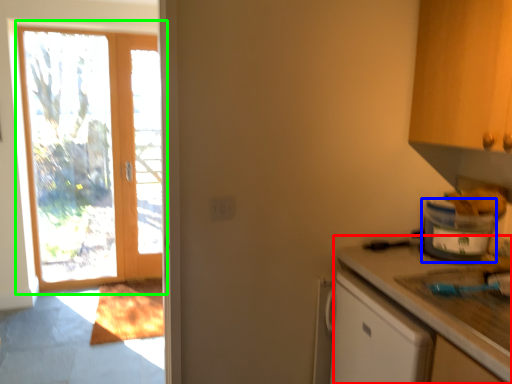
Question: Considering the real-world distances, which object is farthest from countertop (highlighted by a red box)? appliance (highlighted by a blue box) or door (highlighted by a green box)?

Choices:
 (A) appliance
 (B) door

Answer: (B)